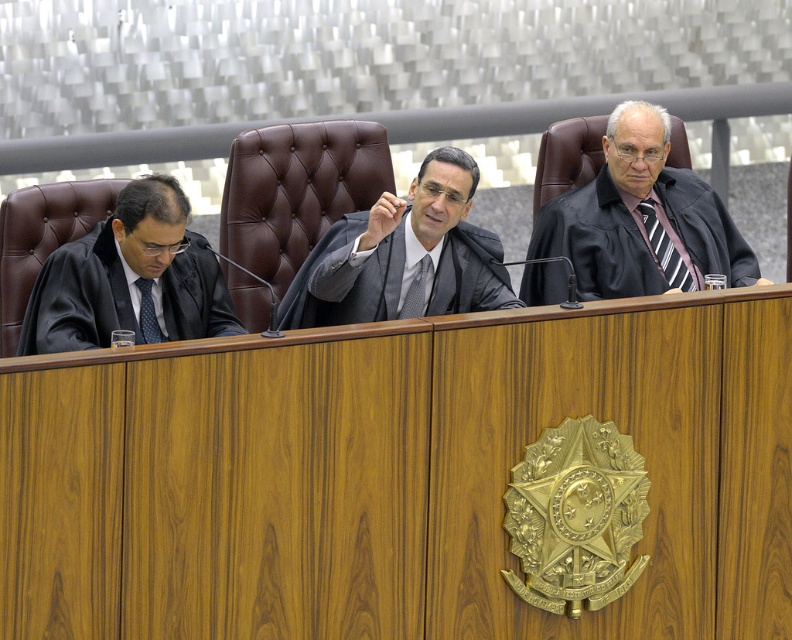
Question: In this image, where is matte black robe at center located relative to black matte robe at left?

Choices:
 (A) left
 (B) right

Answer: (B)

Question: Among these objects, which one is nearest to the camera?

Choices:
 (A) black fabric robe at center
 (B) black matte robe at left
 (C) matte black robe at center

Answer: (B)

Question: Which of the following is the closest to the observer?

Choices:
 (A) black fabric robe at center
 (B) matte black robe at center

Answer: (B)

Question: Can you confirm if black fabric robe at center is positioned above black matte robe at left?

Choices:
 (A) no
 (B) yes

Answer: (B)

Question: Does black fabric robe at center have a larger size compared to matte black robe at center?

Choices:
 (A) no
 (B) yes

Answer: (B)

Question: Which object is the farthest from the matte black robe at center?

Choices:
 (A) black matte robe at left
 (B) black fabric robe at center

Answer: (B)